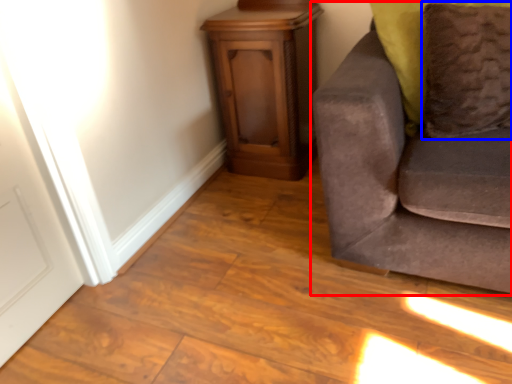
Question: Which object appears closest to the camera in this image, studio couch (highlighted by a red box) or pillow (highlighted by a blue box)?

Choices:
 (A) studio couch
 (B) pillow

Answer: (A)